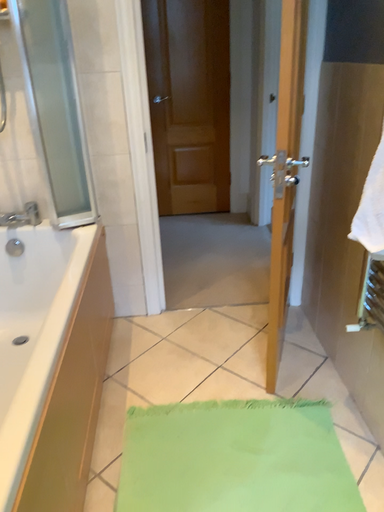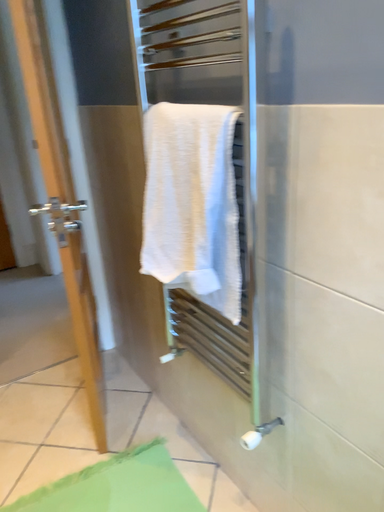
Question: How did the camera likely rotate when shooting the video?

Choices:
 (A) rotated right
 (B) rotated left

Answer: (A)